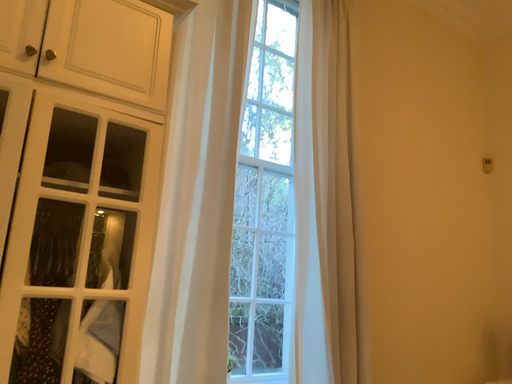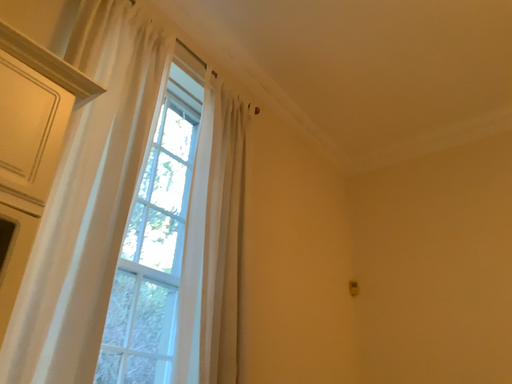
Question: Which way did the camera rotate in the video?

Choices:
 (A) rotated right
 (B) rotated left

Answer: (A)